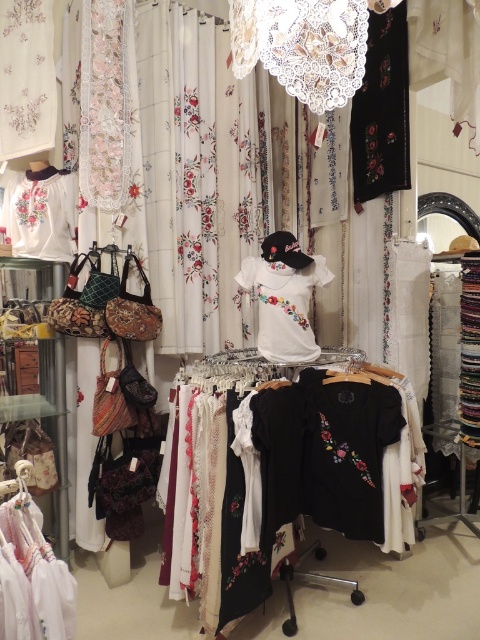
Question: Does white embroidered blouse at upper left have a greater width compared to white cotton blouse at lower left?

Choices:
 (A) yes
 (B) no

Answer: (A)

Question: Which of the following is the closest to the observer?

Choices:
 (A) (67, 209)
 (B) (71, 579)

Answer: (B)

Question: Is black cotton shirts at center above white embroidered blouse at upper left?

Choices:
 (A) no
 (B) yes

Answer: (A)

Question: Which point appears farthest from the camera in this image?

Choices:
 (A) (396, 412)
 (B) (29, 234)

Answer: (B)

Question: Which point is closer to the camera?

Choices:
 (A) (213, 385)
 (B) (64, 212)
 (C) (36, 634)

Answer: (C)

Question: Does black cotton shirts at center lie in front of white embroidered shirt at center?

Choices:
 (A) no
 (B) yes

Answer: (B)